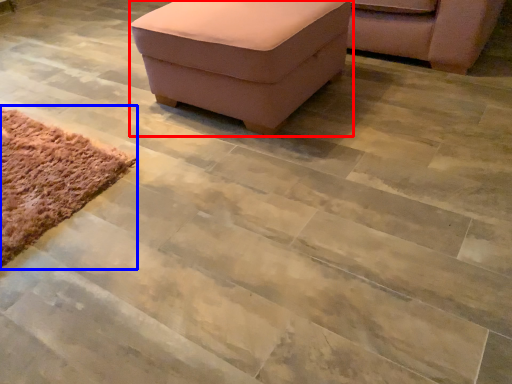
Question: Which object appears closest to the camera in this image, furniture (highlighted by a red box) or mat (highlighted by a blue box)?

Choices:
 (A) furniture
 (B) mat

Answer: (B)